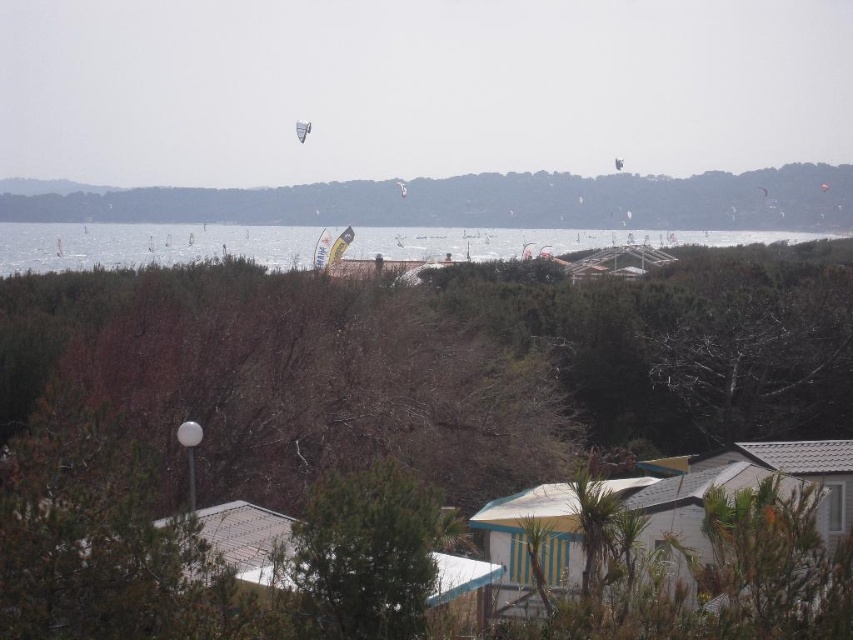
You are a hiker planning to take a photo of the green leafy hillside at upper center and the green leafy tree at center from a distance. How far apart are these two landmarks?

The green leafy hillside at upper center and the green leafy tree at center are 67.58 meters apart.